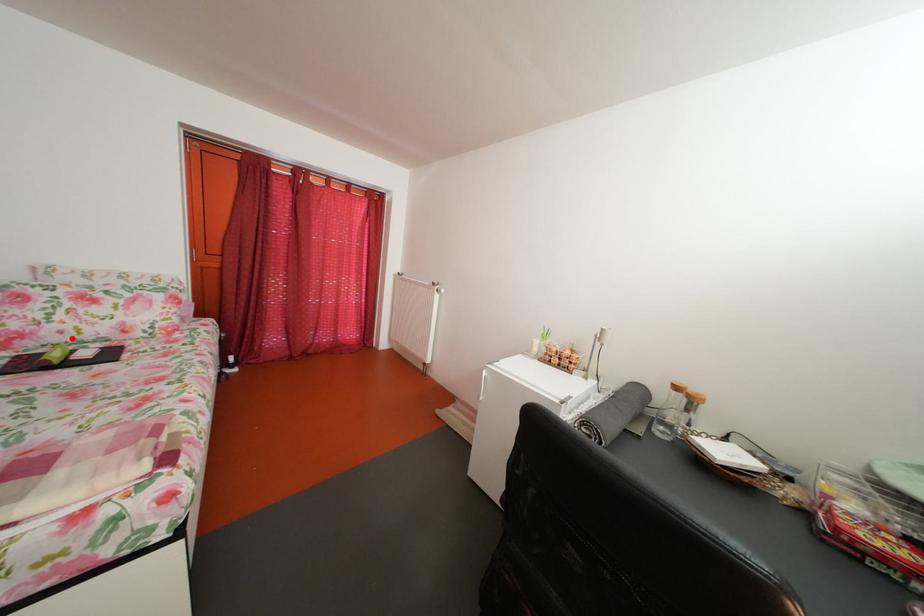
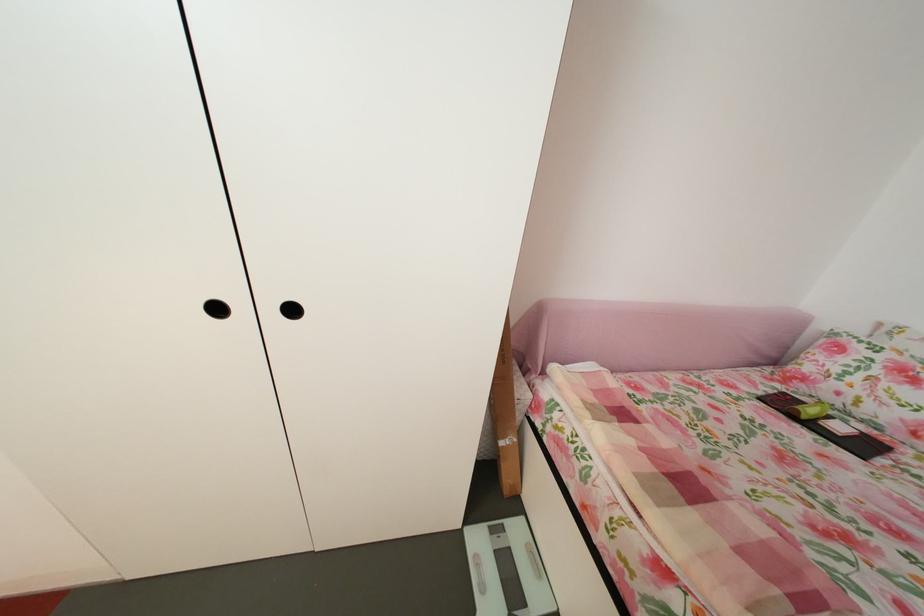
Question: I am providing you with two images of the same scene from different viewpoints. A red point is shown in image1. For the corresponding object point in image2, is it positioned nearer or farther from the camera?

Choices:
 (A) Nearer
 (B) Farther

Answer: (B)